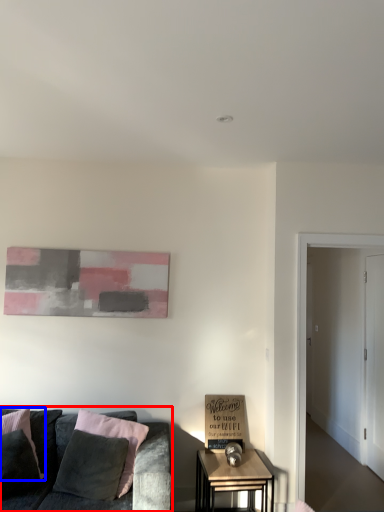
Question: Which object is further to the camera taking this photo, studio couch (highlighted by a red box) or pillow (highlighted by a blue box)?

Choices:
 (A) studio couch
 (B) pillow

Answer: (B)